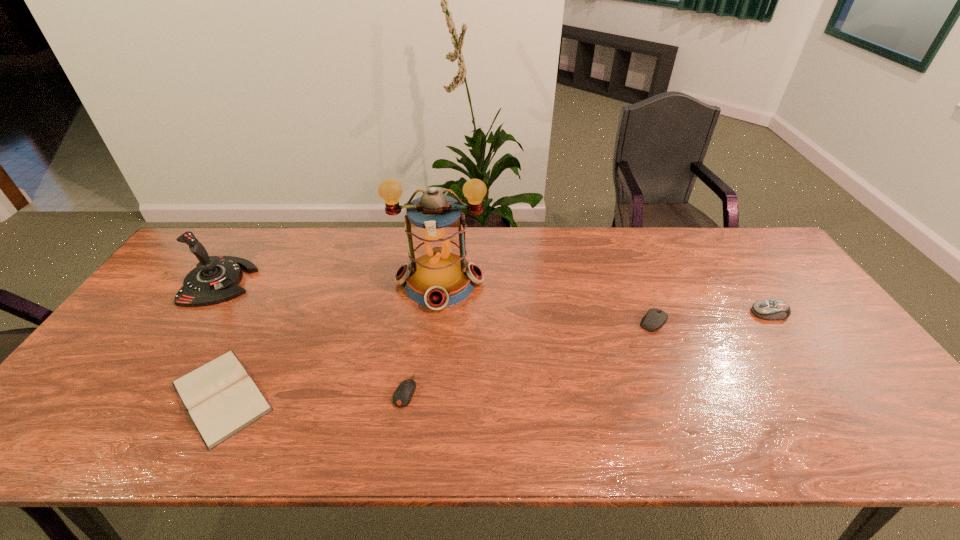
Locate an element on the screen. This screenshot has width=960, height=540. vacant region between the lantern and the second tallest object is located at coordinates (330, 282).

You are a GUI agent. You are given a task and a screenshot of the screen. Output one action in this format:
    pyautogui.click(x=<x>, y=<y>)
    Task: Click on the vacant space that is in between the tallest object and the joystick
    The width and height of the screenshot is (960, 540).
    Given the screenshot: What is the action you would take?
    pyautogui.click(x=330, y=282)

Identify the location of free space between the tallest computer mouse and the second tallest object. (495, 298).

Locate an element on the screen. The width and height of the screenshot is (960, 540). free space between the nearest computer mouse and the joystick is located at coordinates (313, 336).

Locate an element on the screen. free space between the fifth object from left to right and the nearest computer mouse is located at coordinates (529, 356).

Identify the location of vacant space that is in between the second tallest object and the nearest computer mouse. (313, 336).

Where is `vacant area that lies between the tallest object and the joystick`? The height and width of the screenshot is (540, 960). vacant area that lies between the tallest object and the joystick is located at coordinates [x=330, y=282].

In order to click on free space between the leftmost computer mouse and the second object from right to left in this screenshot , I will do `click(529, 356)`.

Identify which object is the fourth closest to the fifth object from left to right. Please provide its 2D coordinates. Your answer should be formatted as a tuple, i.e. [(x, y)], where the tuple contains the x and y coordinates of a point satisfying the conditions above.

[(221, 398)]

Identify the location of object that is the fifth nearest to the shortest object. This screenshot has height=540, width=960. (766, 309).